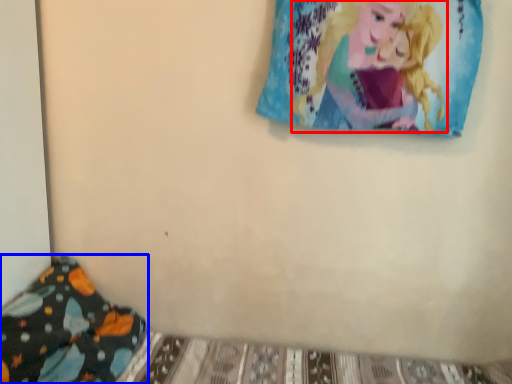
Question: Which object appears farthest to the camera in this image, person (highlighted by a red box) or pillow (highlighted by a blue box)?

Choices:
 (A) person
 (B) pillow

Answer: (A)